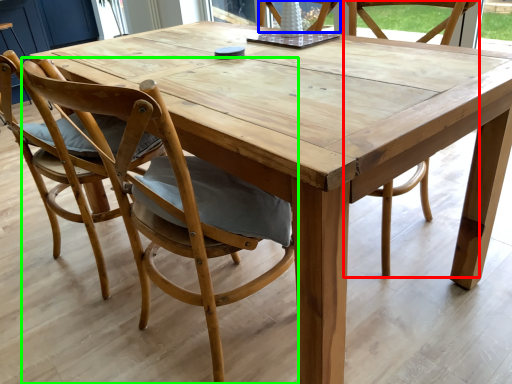
Question: Considering the real-world distances, which object is closest to chair (highlighted by a red box)? chair (highlighted by a blue box) or chair (highlighted by a green box).

Choices:
 (A) chair
 (B) chair

Answer: (A)